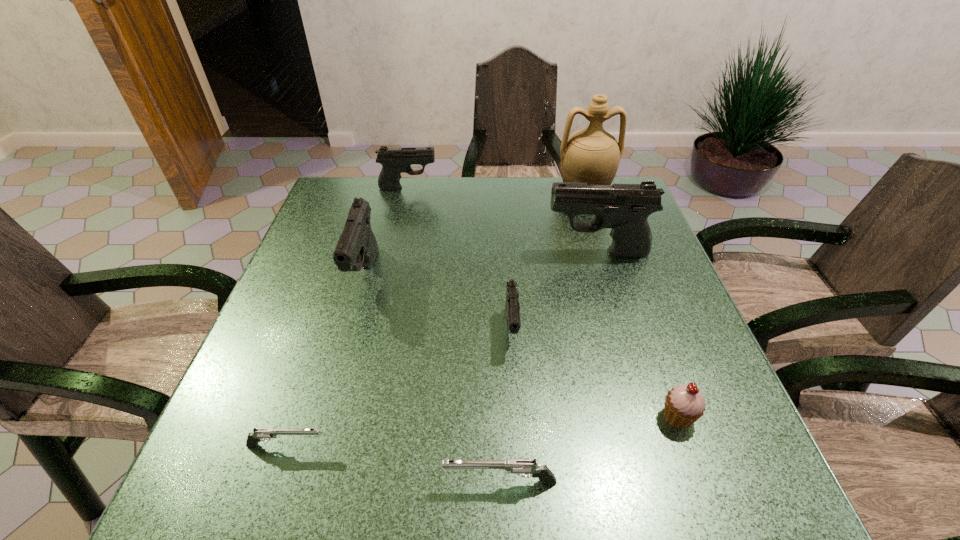
Where is `free region located 0.280m at the barrel of the third shortest pistol`? The image size is (960, 540). free region located 0.280m at the barrel of the third shortest pistol is located at coordinates click(523, 501).

You are a GUI agent. You are given a task and a screenshot of the screen. Output one action in this format:
    pyautogui.click(x=<x>, y=<y>)
    Task: Click on the blank space located on the right of the cupcake
    This screenshot has height=540, width=960.
    Given the screenshot: What is the action you would take?
    pyautogui.click(x=724, y=416)

I want to click on free space located 0.140m on the front-facing side of the right silver pistol, so click(x=357, y=482).

Identify the location of free spot located on the front-facing side of the right silver pistol. (382, 482).

Identify the location of free space located on the front-facing side of the right silver pistol. The height and width of the screenshot is (540, 960). (301, 482).

At what (x,y) coordinates should I click in order to perform the action: click on free location located on the front-facing side of the seventh farthest object. Please return your answer as a coordinate pair (x, y). Looking at the image, I should click on (560, 446).

Identify the location of pitcher located at the far edge. This screenshot has height=540, width=960. (592, 155).

Locate an element on the screen. The height and width of the screenshot is (540, 960). pistol located at the far edge is located at coordinates (394, 161).

This screenshot has height=540, width=960. What are the coordinates of `object positioned at the near edge` in the screenshot? It's located at (522, 467).

Locate an element on the screen. pitcher positioned at the right edge is located at coordinates (592, 155).